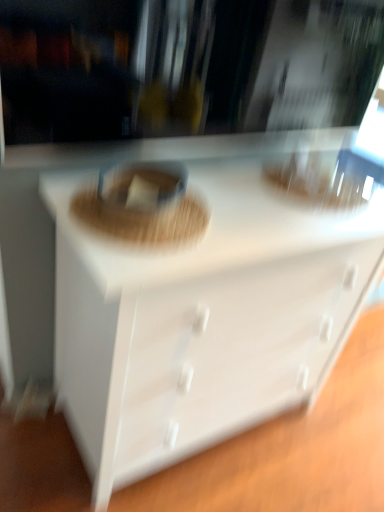
Question: From a real-world perspective, relative to brown woven basket at center, is white glossy chest of drawers at center vertically above or below?

Choices:
 (A) above
 (B) below

Answer: (B)

Question: Is white glossy chest of drawers at center bigger or smaller than brown woven basket at center?

Choices:
 (A) big
 (B) small

Answer: (A)

Question: From the image's perspective, is white glossy chest of drawers at center located above or below brown woven basket at center?

Choices:
 (A) below
 (B) above

Answer: (A)

Question: Considering the positions of brown woven basket at center and white glossy chest of drawers at center in the image, is brown woven basket at center taller or shorter than white glossy chest of drawers at center?

Choices:
 (A) short
 (B) tall

Answer: (A)

Question: Is brown woven basket at center in front of or behind white glossy chest of drawers at center in the image?

Choices:
 (A) front
 (B) behind

Answer: (B)

Question: From the image's perspective, is brown woven basket at center located above or below white glossy chest of drawers at center?

Choices:
 (A) below
 (B) above

Answer: (B)

Question: In terms of width, does brown woven basket at center look wider or thinner when compared to white glossy chest of drawers at center?

Choices:
 (A) thin
 (B) wide

Answer: (A)